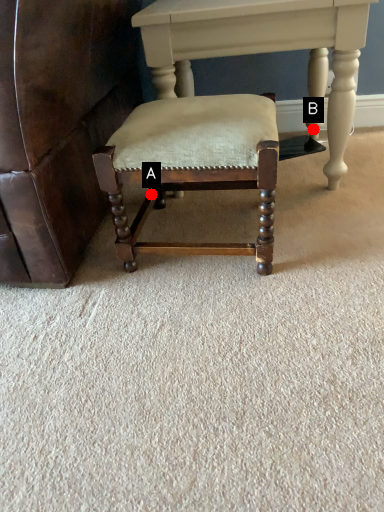
Question: Two points are circled on the image, labeled by A and B beside each circle. Which point is closer to the camera?

Choices:
 (A) A is closer
 (B) B is closer

Answer: (A)